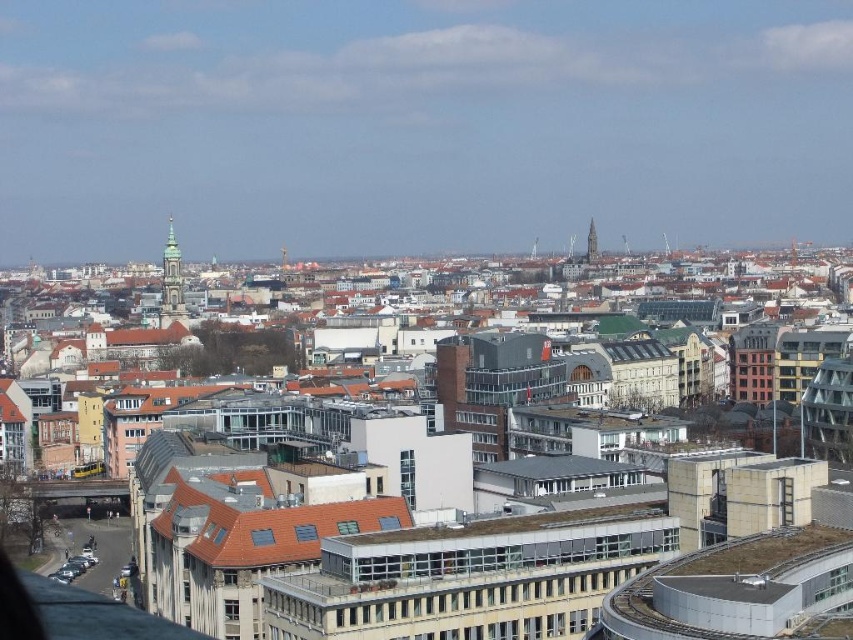
You are an architect analyzing the cityscape. Which structure, the green stone spire at upper left or the smooth stone tower at center, is positioned closer to your viewpoint?

The green stone spire at upper left is closer to the viewer than the smooth stone tower at center.

You are a drone operator who needs to fly a drone between the green stone spire at upper left and the smooth stone tower at center. The drone has a maximum flight distance of 120 meters. Can the drone safely make this journey without exceeding its range?

The green stone spire at upper left is 123.64 meters away from the smooth stone tower at center. Since the drone has a maximum flight distance of 120 meters, it cannot safely make this journey without exceeding its range.